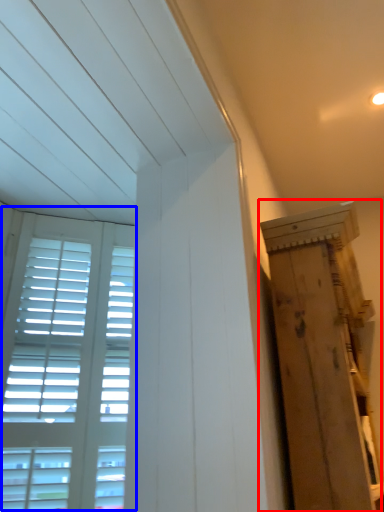
Question: Which object appears farthest to the camera in this image, plywood (highlighted by a red box) or window (highlighted by a blue box)?

Choices:
 (A) plywood
 (B) window

Answer: (B)